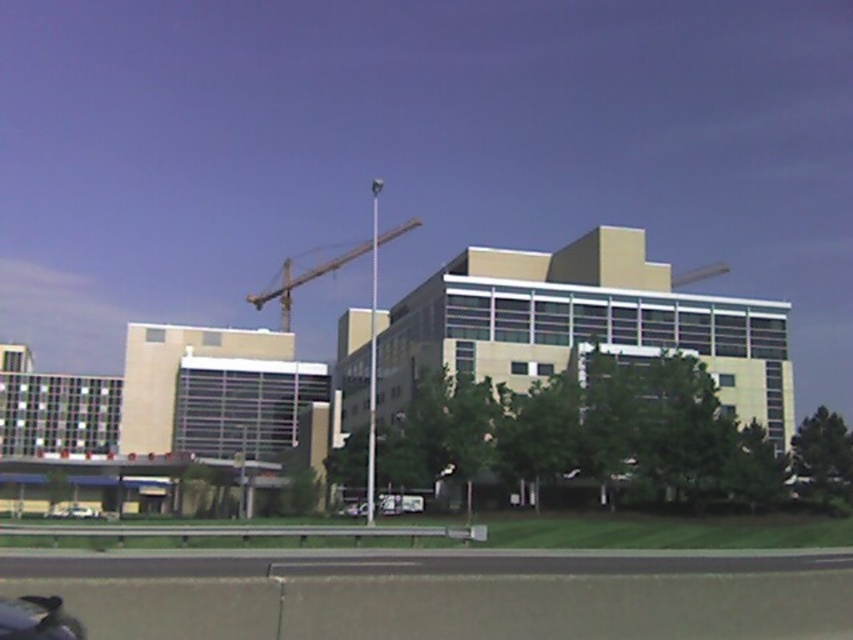
You are a pedestrian standing on the white matte car at lower left. Looking towards the building complex, which direction should you turn to face the black asphalt highway at lower center?

The black asphalt highway at lower center is above the white matte car at lower left. To face the highway, you should look upward since it is positioned higher in the scene.

You are a delivery driver who needs to park your white matte car at lower left near the construction site. The construction site has a metallic gray crane at center. According to safety regulations, vehicles must stay at least 100 meters away from active cranes. Is your current position compliant with the safety regulations?

The metallic gray crane at center and white matte car at lower left are 125.86 meters apart, which is more than the required 100 meters. Therefore, the white matte car at lower left is compliant with the safety regulations as it is parked at a safe distance from the metallic gray crane at center.